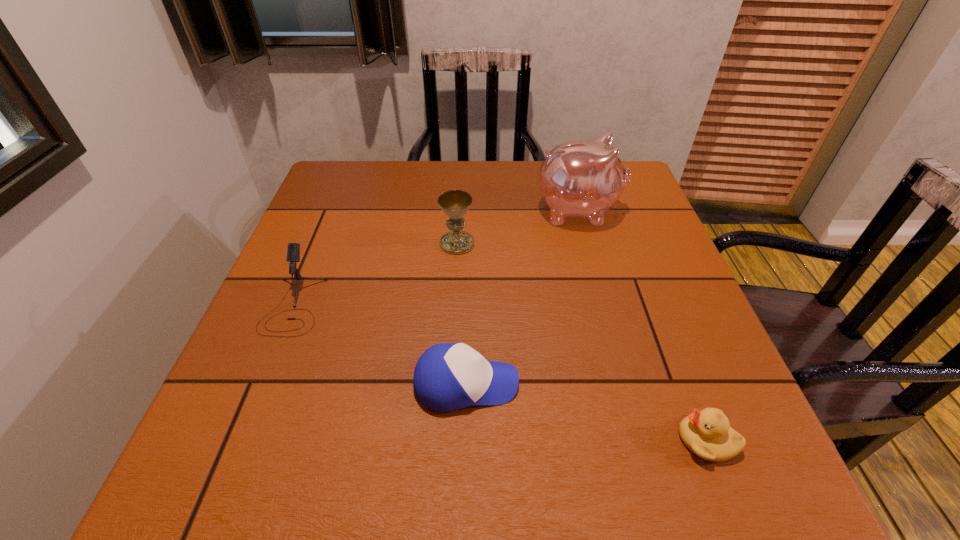
Image resolution: width=960 pixels, height=540 pixels. Identify the location of free space located 0.050m on the front-facing side of the duckling. (647, 440).

Where is `vacant space located on the front-facing side of the duckling`? The image size is (960, 540). vacant space located on the front-facing side of the duckling is located at coordinates (570, 440).

I want to click on vacant area situated 0.400m on the front-facing side of the duckling, so click(x=423, y=440).

Where is `object at the far edge`? The height and width of the screenshot is (540, 960). object at the far edge is located at coordinates (582, 178).

Image resolution: width=960 pixels, height=540 pixels. Identify the location of object that is at the near edge. (707, 433).

This screenshot has height=540, width=960. Identify the location of object present at the left edge. (293, 253).

Find the location of a particular element. The height and width of the screenshot is (540, 960). piggy bank that is at the right edge is located at coordinates [x=582, y=178].

I want to click on duckling that is at the right edge, so click(x=707, y=433).

Where is `object situated at the far right corner`? object situated at the far right corner is located at coordinates pyautogui.click(x=582, y=178).

Locate an element on the screen. This screenshot has height=540, width=960. object at the near right corner is located at coordinates (707, 433).